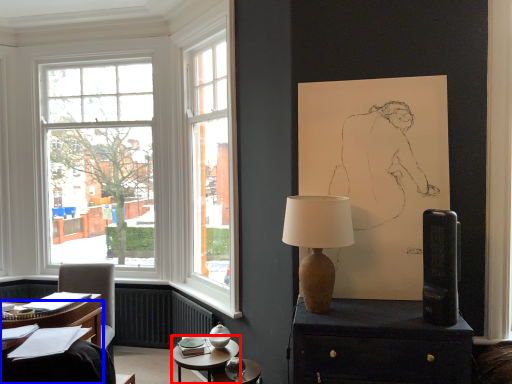
Question: Which object appears closest to the camera in this image, table (highlighted by a red box) or desk (highlighted by a blue box)?

Choices:
 (A) table
 (B) desk

Answer: (B)